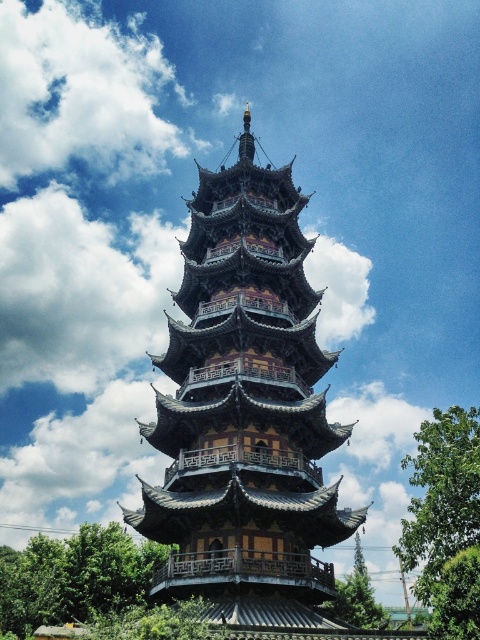
Question: Which of the following is the closest to the observer?

Choices:
 (A) green leafy tree at lower left
 (B) green leafy tree at center

Answer: (B)

Question: In this image, where is green leafy tree at right located relative to green leafy tree at lower left?

Choices:
 (A) below
 (B) above

Answer: (B)

Question: Is green leafy tree at right smaller than green leafy tree at center?

Choices:
 (A) yes
 (B) no

Answer: (B)

Question: Which object appears closest to the camera in this image?

Choices:
 (A) green leafy tree at lower left
 (B) green leafy tree at right

Answer: (B)

Question: Which point is closer to the camera?

Choices:
 (A) (210, 429)
 (B) (460, 470)
 (C) (0, 618)

Answer: (A)

Question: Observing the image, what is the correct spatial positioning of green leafy tree at right in reference to green leafy tree at center?

Choices:
 (A) left
 (B) right

Answer: (B)